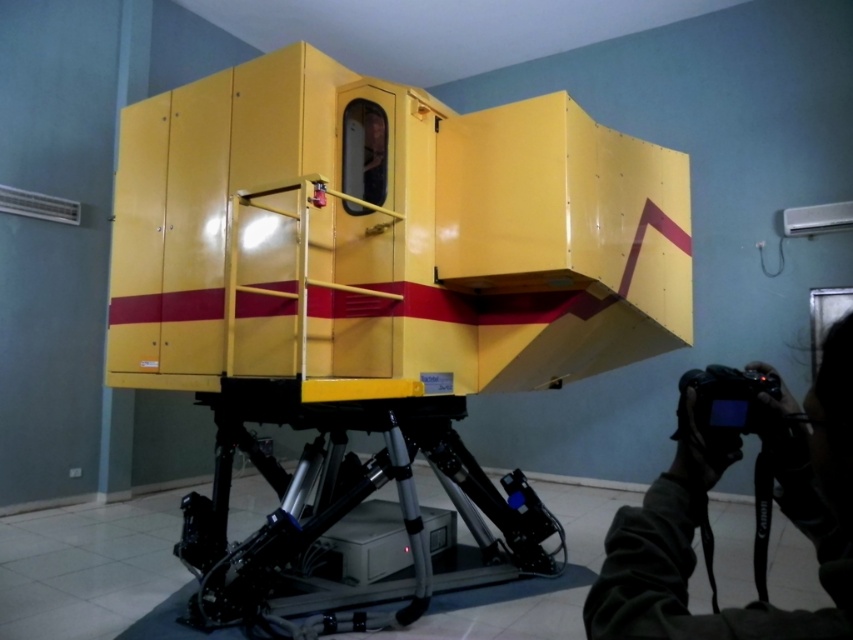
You are setting up equipment for a live event and need to place both the black fabric camera at lower right and the black plastic video camera at lower right on a shelf that is 6 inches wide. Can both cameras fit side by side on the shelf without overlapping?

The black fabric camera at lower right and the black plastic video camera at lower right are 5.53 inches apart, so they can fit side by side on a 6 inch wide shelf since 5.53 inches is less than 6 inches.

You are standing in front of the yellow equipment and notice two points marked on its surface. The first point is at coordinates point [850,368], and the second is at point [744,372]. Which of these points is nearer to your viewpoint?

Point [850,368] is closer to the camera than point [744,372], so the first point is nearer to your viewpoint.

You are setting up equipment in a lab. You have a metallic tripod at lower center and a black fabric camera at lower right. Which object has a greater width?

The metallic tripod at lower center has a greater width than the black fabric camera at lower right.